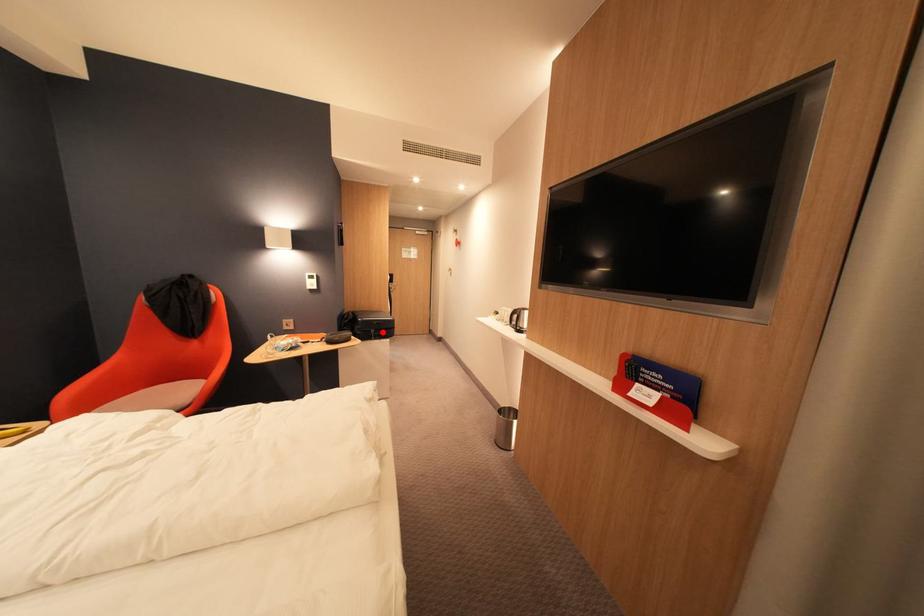
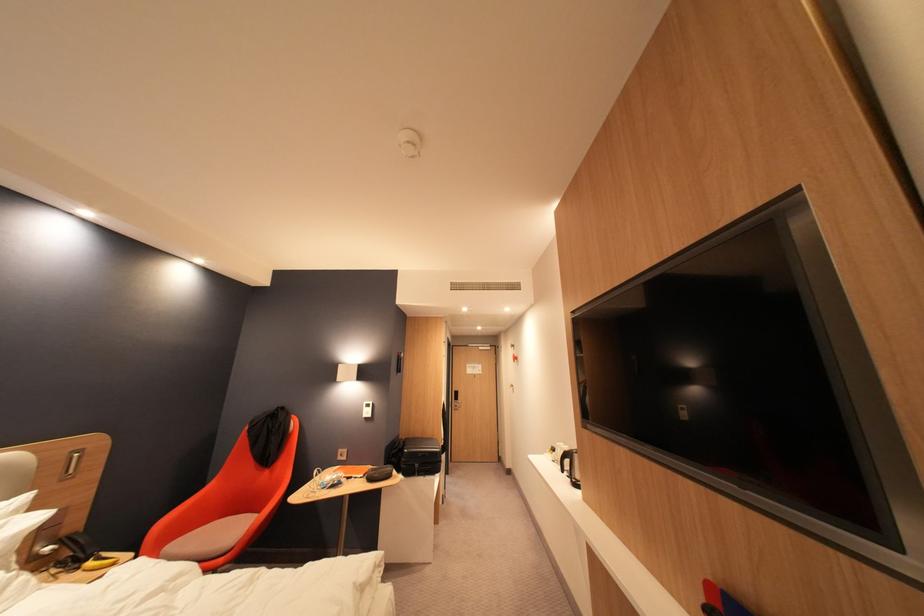
Question: I am providing you with two images of the same scene from different viewpoints. Given a red point in image1, look at the same physical point in image2. Is it:

Choices:
 (A) Closer to the viewpoint
 (B) Farther from the viewpoint

Answer: (B)